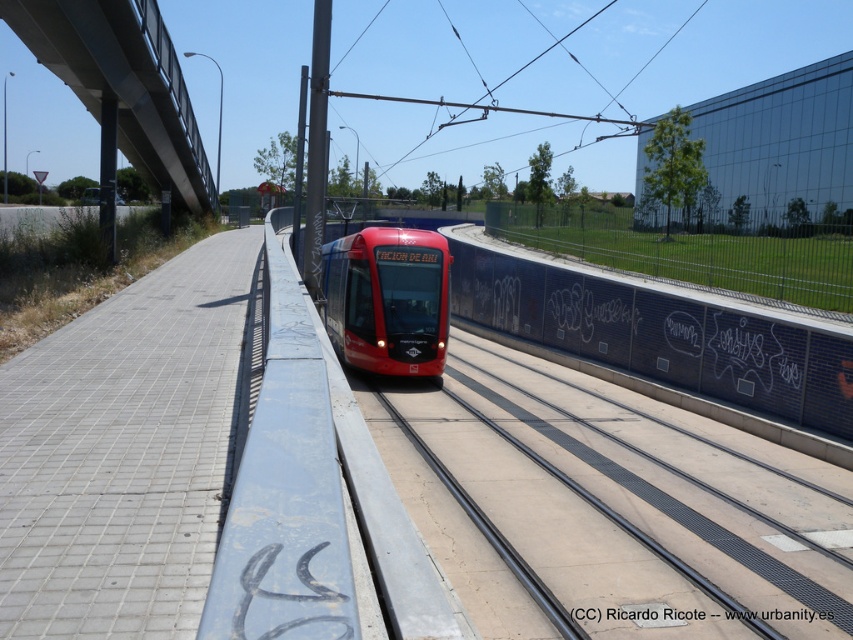
Which is below, metal/textured bridge at upper left or blacktexturedsign at center?

blacktexturedsign at center is below.

Is the position of metal/textured bridge at upper left more distant than that of blacktexturedsign at center?

Yes, it is.

This screenshot has height=640, width=853. What do you see at coordinates (123, 83) in the screenshot?
I see `metal/textured bridge at upper left` at bounding box center [123, 83].

The height and width of the screenshot is (640, 853). Identify the location of metal/textured bridge at upper left. (123, 83).

Does point (39, 48) come farther from viewer compared to point (398, 353)?

No, it is in front of (398, 353).

Can you confirm if metal/textured bridge at upper left is positioned to the right of matte red train at center?

No, metal/textured bridge at upper left is not to the right of matte red train at center.

Is point (142, 61) positioned after point (439, 305)?

No, it is not.

At what (x,y) coordinates should I click in order to perform the action: click on metal/textured bridge at upper left. Please return your answer as a coordinate pair (x, y). This screenshot has width=853, height=640. Looking at the image, I should click on (x=123, y=83).

Who is more distant from viewer, [393,317] or [647,624]?

The point [393,317] is more distant.

Does matte red train at center have a lesser width compared to blacktexturedsign at center?

No, matte red train at center is not thinner than blacktexturedsign at center.

Is point (361, 353) positioned before point (788, 620)?

No, it is not.

Find the location of a particular element. The width and height of the screenshot is (853, 640). matte red train at center is located at coordinates (387, 300).